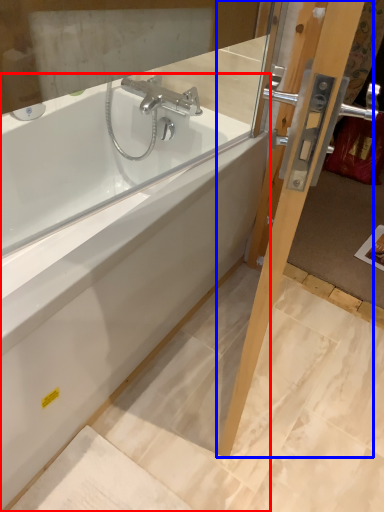
Question: Which of the following is the closest to the observer, bathtub (highlighted by a red box) or screen door (highlighted by a blue box)?

Choices:
 (A) bathtub
 (B) screen door

Answer: (B)